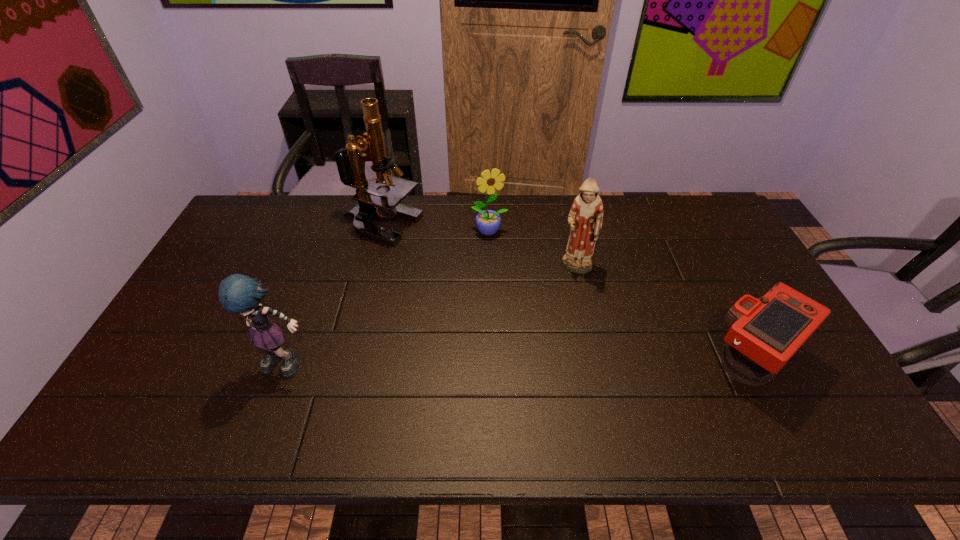
The width and height of the screenshot is (960, 540). I want to click on unoccupied position between the shortest object and the third nearest object, so click(664, 315).

The image size is (960, 540). What are the coordinates of `vacant space that is in between the sunflower and the rag doll` in the screenshot? It's located at (390, 298).

This screenshot has width=960, height=540. What are the coordinates of `empty location between the rag doll and the microscope` in the screenshot? It's located at (336, 295).

You are a GUI agent. You are given a task and a screenshot of the screen. Output one action in this format:
    pyautogui.click(x=<x>, y=<y>)
    Task: Click on the empty space that is in between the rightmost object and the tallest object
    The image size is (960, 540).
    Given the screenshot: What is the action you would take?
    (566, 293)

You are a GUI agent. You are given a task and a screenshot of the screen. Output one action in this format:
    pyautogui.click(x=<x>, y=<y>)
    Task: Click on the vacant area between the rag doll and the third farthest object
    This screenshot has height=540, width=960.
    Given the screenshot: What is the action you would take?
    pyautogui.click(x=434, y=317)

Where is `free space between the rightmost object and the fourth object from left to right`? free space between the rightmost object and the fourth object from left to right is located at coordinates (664, 315).

Identify the location of unoccupied position between the camera and the third object from left to right. (620, 296).

Locate an element on the screen. The height and width of the screenshot is (540, 960). empty space between the rag doll and the figurine is located at coordinates pos(434,317).

You are a GUI agent. You are given a task and a screenshot of the screen. Output one action in this format:
    pyautogui.click(x=<x>, y=<y>)
    Task: Click on the vacant point located between the sunflower and the second object from right to left
    
    Given the screenshot: What is the action you would take?
    pyautogui.click(x=534, y=251)

Locate an element on the screen. The width and height of the screenshot is (960, 540). free space between the microscope and the figurine is located at coordinates (479, 248).